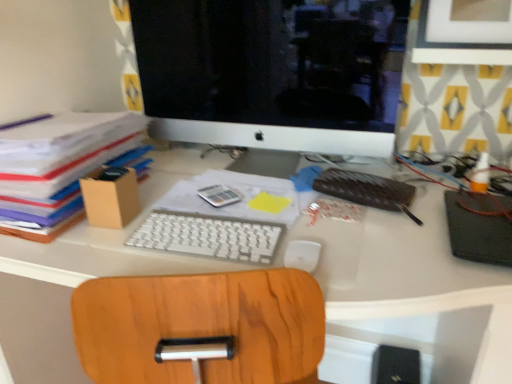
I want to click on leather-bound notebook at center-right, the second notebook from the right, so click(365, 189).

What do you see at coordinates (261, 75) in the screenshot?
I see `white glossy computer monitor at upper center` at bounding box center [261, 75].

What do you see at coordinates (57, 167) in the screenshot? The height and width of the screenshot is (384, 512). I see `brown cardboard box at left` at bounding box center [57, 167].

The image size is (512, 384). Find the location of `white plastic keyboard at center`. white plastic keyboard at center is located at coordinates (209, 236).

What are the coordinates of `black matte notebook at right, which ranks as the second notebook in left-to-right order` in the screenshot? It's located at (480, 226).

Find the location of `white matte mouse at center`. white matte mouse at center is located at coordinates click(302, 255).

Considering the positions of objects white matte mouse at center and leather-bound notebook at center-right, the second notebook from the right, in the image provided, who is more to the right, white matte mouse at center or leather-bound notebook at center-right, the second notebook from the right,?

From the viewer's perspective, leather-bound notebook at center-right, the second notebook from the right, appears more on the right side.

Looking at this image, is white matte mouse at center in front of or behind leather-bound notebook at center-right, the 1th notebook in the left-to-right sequence, in the image?

Clearly, white matte mouse at center is in front of leather-bound notebook at center-right, the 1th notebook in the left-to-right sequence.

From a real-world perspective, who is located lower, white matte mouse at center or leather-bound notebook at center-right, the second notebook from the right?

white matte mouse at center, from a real-world perspective.

Is white glossy computer monitor at upper center bigger than white matte mouse at center?

Correct, white glossy computer monitor at upper center is larger in size than white matte mouse at center.

Does white glossy computer monitor at upper center come behind white matte mouse at center?

Yes, it is behind white matte mouse at center.

Is white glossy computer monitor at upper center at the left side of white matte mouse at center?

Yes, white glossy computer monitor at upper center is to the left of white matte mouse at center.

Is point (222, 50) in front of point (302, 242)?

No, it is behind (302, 242).

This screenshot has width=512, height=384. What are the coordinates of `notebook that is the 2nd object located below the white glossy computer monitor at upper center (from the image's perspective)` in the screenshot? It's located at (480, 226).

Is white glossy computer monitor at upper center positioned with its back to black matte notebook at right, which ranks as the second notebook in left-to-right order?

That's not correct — white glossy computer monitor at upper center is not looking away from black matte notebook at right, which ranks as the second notebook in left-to-right order.

Between white glossy computer monitor at upper center and black matte notebook at right, which ranks as the second notebook in left-to-right order, which one has larger size?

white glossy computer monitor at upper center.

From the picture: Can you tell me how much white glossy computer monitor at upper center and black matte notebook at right, acting as the 1th notebook starting from the right, differ in facing direction?

0.0907 degrees separate the facing orientations of white glossy computer monitor at upper center and black matte notebook at right, acting as the 1th notebook starting from the right.

Who is smaller, brown cardboard box at left or white matte mouse at center?

Smaller between the two is white matte mouse at center.

Which object is positioned more to the left, brown cardboard box at left or white matte mouse at center?

From the viewer's perspective, brown cardboard box at left appears more on the left side.

In terms of height, does brown cardboard box at left look taller or shorter compared to white matte mouse at center?

Considering their sizes, brown cardboard box at left has more height than white matte mouse at center.

Is brown cardboard box at left wider than white matte mouse at center?

Yes, brown cardboard box at left is wider than white matte mouse at center.

From a real-world perspective, which is physically above, white glossy computer monitor at upper center or white plastic keyboard at center?

From a 3D spatial view, white glossy computer monitor at upper center is above.

Which of these two, white glossy computer monitor at upper center or white plastic keyboard at center, stands shorter?

white glossy computer monitor at upper center.

From the image's perspective, would you say white glossy computer monitor at upper center is positioned over white plastic keyboard at center?

Yes, from the image's perspective, white glossy computer monitor at upper center is over white plastic keyboard at center.

Where is `desk in front of the leather-bound notebook at center-right, the second notebook from the right`? Image resolution: width=512 pixels, height=384 pixels. desk in front of the leather-bound notebook at center-right, the second notebook from the right is located at coordinates (416, 287).

Could you tell me if white plastic keyboard at center is turned towards leather-bound notebook at center-right, the 1th notebook in the left-to-right sequence?

No, white plastic keyboard at center does not turn towards leather-bound notebook at center-right, the 1th notebook in the left-to-right sequence.

From the picture: From the image's perspective, is white plastic keyboard at center below leather-bound notebook at center-right, the 1th notebook in the left-to-right sequence?

Yes, from the image's perspective, white plastic keyboard at center is beneath leather-bound notebook at center-right, the 1th notebook in the left-to-right sequence.

How distant is white matte mouse at center from white glossy computer monitor at upper center?

white matte mouse at center is 19.29 inches away from white glossy computer monitor at upper center.

Does white matte mouse at center have a lesser width compared to white glossy computer monitor at upper center?

Yes.

In the scene shown: Which is nearer, (x=304, y=245) or (x=275, y=60)?

Clearly, point (x=304, y=245) is closer to the camera than point (x=275, y=60).

From a real-world perspective, which is physically above, white matte mouse at center or white glossy computer monitor at upper center?

In real-world perspective, white glossy computer monitor at upper center is above.

This screenshot has width=512, height=384. Find the location of `mouse in front of the leather-bound notebook at center-right, the 1th notebook in the left-to-right sequence`. mouse in front of the leather-bound notebook at center-right, the 1th notebook in the left-to-right sequence is located at coordinates (302, 255).

Find the location of `mouse below the white glossy computer monitor at upper center (from a real-world perspective)`. mouse below the white glossy computer monitor at upper center (from a real-world perspective) is located at coordinates (302, 255).

When comparing their distances from black matte notebook at right, acting as the 1th notebook starting from the right, does white glossy computer monitor at upper center or white matte mouse at center seem closer?

white matte mouse at center is positioned closer to the anchor black matte notebook at right, acting as the 1th notebook starting from the right.

Looking at the image, which one is located further to brown cardboard box at left, white glossy computer monitor at upper center or white plastic keyboard at center?

Based on the image, white glossy computer monitor at upper center appears to be further to brown cardboard box at left.

From the image, which object appears to be nearer to leather-bound notebook at center-right, the 1th notebook in the left-to-right sequence, white glossy computer monitor at upper center or white matte mouse at center?

Based on the image, white matte mouse at center appears to be nearer to leather-bound notebook at center-right, the 1th notebook in the left-to-right sequence.

Considering their positions, is brown cardboard box at left positioned closer to black matte notebook at right, acting as the 1th notebook starting from the right, than leather-bound notebook at center-right, the second notebook from the right?

leather-bound notebook at center-right, the second notebook from the right.

Looking at the image, which one is located further to white plastic keyboard at center, white glossy computer monitor at upper center or white plastic keyboard at center?

white glossy computer monitor at upper center.

Estimate the real-world distances between objects in this image. Which object is further from brown cardboard box at left, white plastic keyboard at center or white glossy computer monitor at upper center?

white glossy computer monitor at upper center is positioned further to the anchor brown cardboard box at left.

Estimate the real-world distances between objects in this image. Which object is closer to leather-bound notebook at center-right, the second notebook from the right, white plastic keyboard at center or white glossy computer monitor at upper center?

Based on the image, white glossy computer monitor at upper center appears to be nearer to leather-bound notebook at center-right, the second notebook from the right.

Looking at the image, which one is located closer to black matte notebook at right, acting as the 1th notebook starting from the right, white plastic keyboard at center or brown cardboard box at left?

Among the two, white plastic keyboard at center is located nearer to black matte notebook at right, acting as the 1th notebook starting from the right.

In order to click on notebook between white plastic keyboard at center and black matte notebook at right, acting as the 1th notebook starting from the right in this screenshot , I will do `click(365, 189)`.

Find the location of a particular element. Image resolution: width=512 pixels, height=384 pixels. computer monitor between white plastic keyboard at center and black matte notebook at right, acting as the 1th notebook starting from the right, in the horizontal direction is located at coordinates pyautogui.click(x=261, y=75).

In order to click on computer keyboard between brown cardboard box at left and white glossy computer monitor at upper center from left to right in this screenshot , I will do `click(209, 236)`.

I want to click on computer monitor between brown cardboard box at left and white matte mouse at center in the horizontal direction, so click(x=261, y=75).